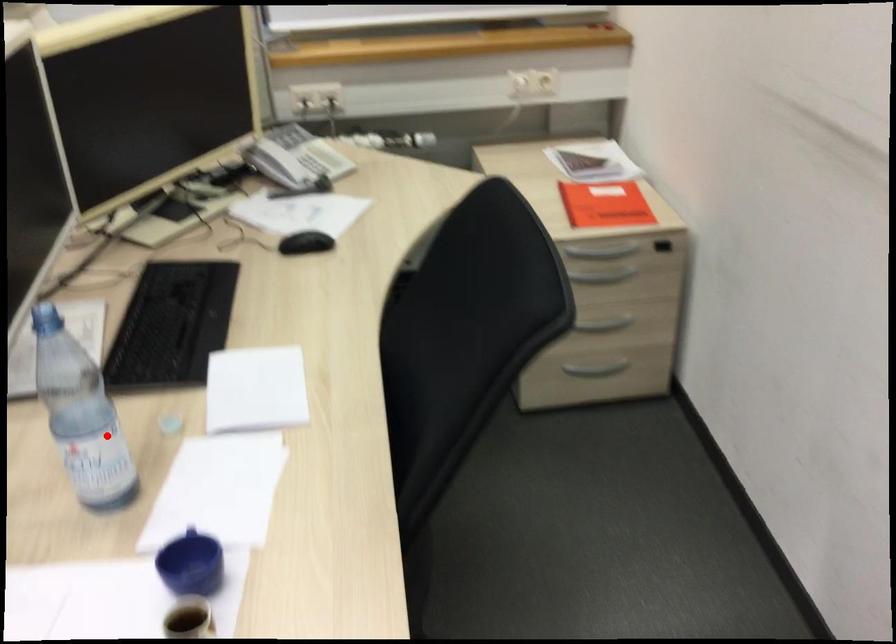
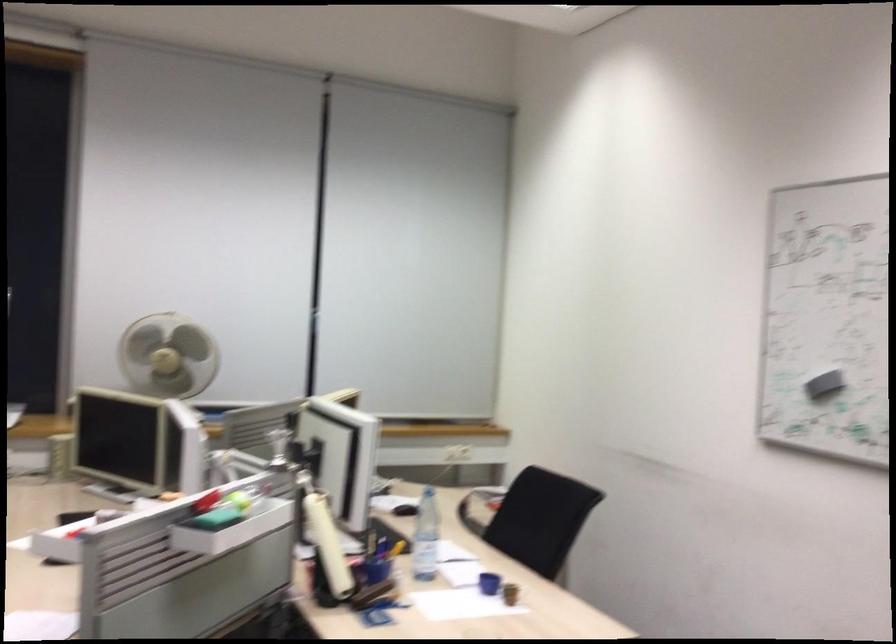
Question: I am providing you with two images of the same scene from different viewpoints. In image1, a red point is highlighted. Considering the same 3D point in image2, which of the following is correct?

Choices:
 (A) It is closer
 (B) It is farther

Answer: (B)